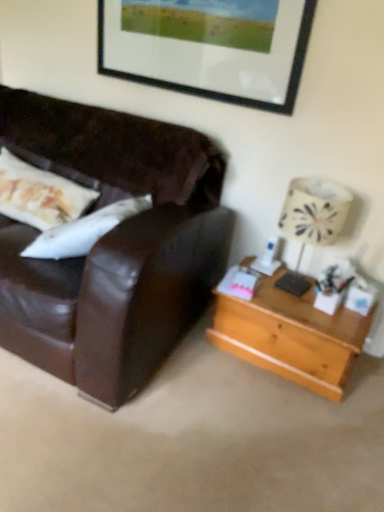
Image resolution: width=384 pixels, height=512 pixels. Identify the location of free point in front of light brown wooden table at right. (287, 425).